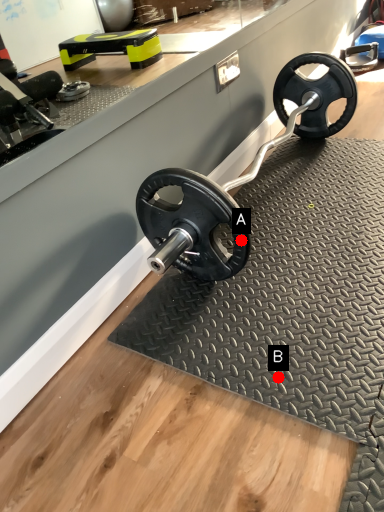
Question: Two points are circled on the image, labeled by A and B beside each circle. Which point is farther to the camera?

Choices:
 (A) A is further
 (B) B is further

Answer: (A)